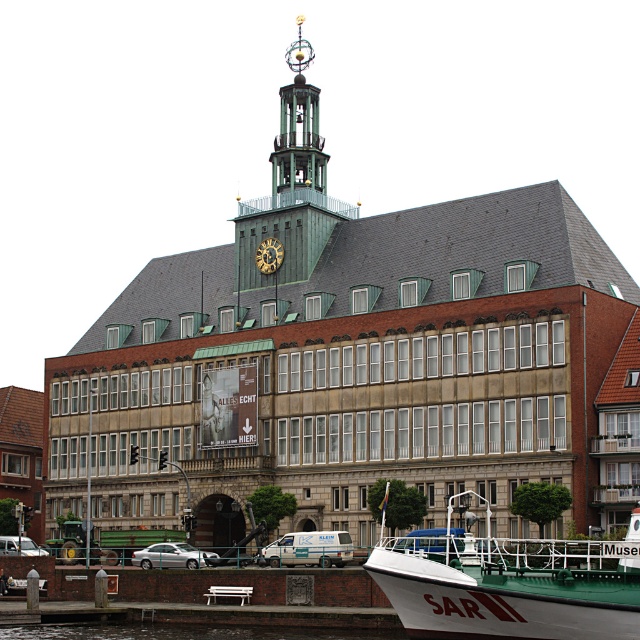
Can you confirm if gold-plated metal clock tower at upper center is thinner than green glass bell tower at upper center?

No.

In the scene shown: Who is positioned more to the left, gold-plated metal clock tower at upper center or green glass bell tower at upper center?

gold-plated metal clock tower at upper center

This screenshot has height=640, width=640. Describe the element at coordinates (291, 188) in the screenshot. I see `gold-plated metal clock tower at upper center` at that location.

Locate an element on the screen. gold-plated metal clock tower at upper center is located at coordinates (291, 188).

Which is above, transparent water at lower center or gold metallic clock at center?

gold metallic clock at center is above.

Does transparent water at lower center have a greater width compared to gold metallic clock at center?

Correct, the width of transparent water at lower center exceeds that of gold metallic clock at center.

Between point (292, 627) and point (269, 241), which one is positioned in front?

Point (292, 627) is more forward.

The width and height of the screenshot is (640, 640). I want to click on transparent water at lower center, so click(188, 632).

Image resolution: width=640 pixels, height=640 pixels. I want to click on gold-plated metal clock tower at upper center, so click(291, 188).

Is point (353, 208) behind point (326, 636)?

Yes, point (353, 208) is behind point (326, 636).

This screenshot has width=640, height=640. What do you see at coordinates (291, 188) in the screenshot? I see `gold-plated metal clock tower at upper center` at bounding box center [291, 188].

Identify the location of gold-plated metal clock tower at upper center. This screenshot has width=640, height=640. (291, 188).